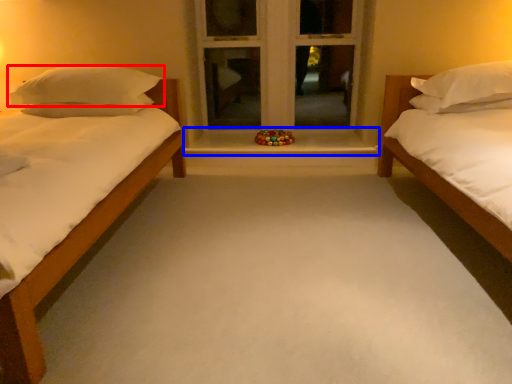
Question: Which object is closer to the camera taking this photo, pillow (highlighted by a red box) or window sill (highlighted by a blue box)?

Choices:
 (A) pillow
 (B) window sill

Answer: (A)